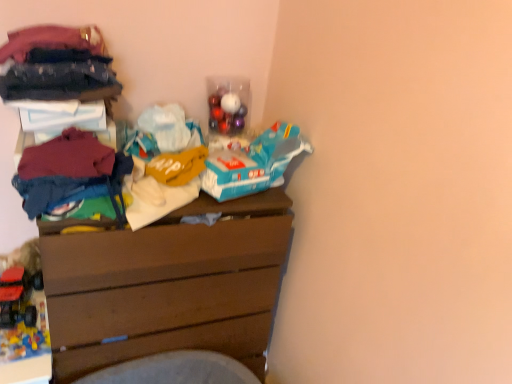
The width and height of the screenshot is (512, 384). What do you see at coordinates (70, 172) in the screenshot?
I see `maroon cotton sweater at left, marked as the third clothing in a top-to-bottom arrangement` at bounding box center [70, 172].

Identify the location of dark blue fabric at upper left, positioned as the first clothing in top-to-bottom order. This screenshot has width=512, height=384. (52, 41).

From the picture: How much space does dark blue fabric at upper left, positioned as the third clothing in bottom-to-top order, occupy horizontally?

The width of dark blue fabric at upper left, positioned as the third clothing in bottom-to-top order, is 11.61 inches.

How much space does rubberized plastic toy truck at lower left, positioned as the 1th toy in bottom-to-top order, occupy vertically?

The height of rubberized plastic toy truck at lower left, positioned as the 1th toy in bottom-to-top order, is 1.82 centimeters.

Find the location of `dark blue fabric at upper left, which is the 2th clothing from top to bottom`. dark blue fabric at upper left, which is the 2th clothing from top to bottom is located at coordinates (60, 82).

Find the location of a particular element. This screenshot has width=512, height=384. maroon cotton sweater at left, the first clothing when ordered from bottom to top is located at coordinates (70, 172).

Is brown wooden chest of drawers at center a part of maroon cotton sweater at left, marked as the third clothing in a top-to-bottom arrangement?

No, brown wooden chest of drawers at center is not inside maroon cotton sweater at left, marked as the third clothing in a top-to-bottom arrangement.

Is maroon cotton sweater at left, marked as the third clothing in a top-to-bottom arrangement, facing towards brown wooden chest of drawers at center?

No.

From the image's perspective, who appears lower, maroon cotton sweater at left, the first clothing when ordered from bottom to top, or brown wooden chest of drawers at center?

From the image's view, brown wooden chest of drawers at center is below.

Consider the image. Is rubberized plastic toy truck at lower left, which ranks as the second toy in top-to-bottom order, smaller than maroon cotton sweater at left, marked as the third clothing in a top-to-bottom arrangement?

Correct, rubberized plastic toy truck at lower left, which ranks as the second toy in top-to-bottom order, occupies less space than maroon cotton sweater at left, marked as the third clothing in a top-to-bottom arrangement.

The width and height of the screenshot is (512, 384). Identify the location of toy that is the 1st one when counting leftward from the maroon cotton sweater at left, the first clothing when ordered from bottom to top. (24, 342).

Is rubberized plastic toy truck at lower left, positioned as the 1th toy in bottom-to-top order, aimed at maroon cotton sweater at left, marked as the third clothing in a top-to-bottom arrangement?

No, rubberized plastic toy truck at lower left, positioned as the 1th toy in bottom-to-top order, is not oriented towards maroon cotton sweater at left, marked as the third clothing in a top-to-bottom arrangement.

Is maroon cotton sweater at left, the first clothing when ordered from bottom to top, surrounded by rubberized plastic toy truck at lower left, which ranks as the second toy in top-to-bottom order?

Definitely not — maroon cotton sweater at left, the first clothing when ordered from bottom to top, is not inside rubberized plastic toy truck at lower left, which ranks as the second toy in top-to-bottom order.

Is brown wooden chest of drawers at center inside the boundaries of dark blue fabric at upper left, positioned as the third clothing in bottom-to-top order, or outside?

brown wooden chest of drawers at center is spatially situated outside dark blue fabric at upper left, positioned as the third clothing in bottom-to-top order.

In the scene shown: From a real-world perspective, is brown wooden chest of drawers at center below dark blue fabric at upper left, positioned as the first clothing in top-to-bottom order?

Yes.

Which is in front, brown wooden chest of drawers at center or dark blue fabric at upper left, positioned as the third clothing in bottom-to-top order?

dark blue fabric at upper left, positioned as the third clothing in bottom-to-top order, is closer to the camera.

Can you tell me how much brown wooden chest of drawers at center and dark blue fabric at upper left, positioned as the first clothing in top-to-bottom order, differ in facing direction?

They differ by 0.903 degrees in their facing directions.

Would you say rubberized plastic toy truck at lower left, which ranks as the second toy in top-to-bottom order, is outside brown wooden chest of drawers at center?

rubberized plastic toy truck at lower left, which ranks as the second toy in top-to-bottom order, lies outside brown wooden chest of drawers at center's area.

Is there a large distance between rubberized plastic toy truck at lower left, positioned as the 1th toy in bottom-to-top order, and brown wooden chest of drawers at center?

Actually, rubberized plastic toy truck at lower left, positioned as the 1th toy in bottom-to-top order, and brown wooden chest of drawers at center are a little close together.

Which object is positioned more to the left, rubberized plastic toy truck at lower left, which ranks as the second toy in top-to-bottom order, or brown wooden chest of drawers at center?

rubberized plastic toy truck at lower left, which ranks as the second toy in top-to-bottom order.

I want to click on toy that is the 1st one when counting backward from the brown wooden chest of drawers at center, so click(24, 342).

Is point (99, 32) less distant than point (28, 315)?

Yes, it is.

Looking at their sizes, would you say dark blue fabric at upper left, positioned as the third clothing in bottom-to-top order, is wider or thinner than rubberized plastic toy truck at lower left, placed as the 2th toy when sorted from bottom to top?

dark blue fabric at upper left, positioned as the third clothing in bottom-to-top order, is wider than rubberized plastic toy truck at lower left, placed as the 2th toy when sorted from bottom to top.

Between dark blue fabric at upper left, positioned as the third clothing in bottom-to-top order, and rubberized plastic toy truck at lower left, acting as the first toy starting from the top, which one has more height?

rubberized plastic toy truck at lower left, acting as the first toy starting from the top, is taller.

Choose the correct answer: Is dark blue fabric at upper left, positioned as the third clothing in bottom-to-top order, inside rubberized plastic toy truck at lower left, placed as the 2th toy when sorted from bottom to top, or outside it?

dark blue fabric at upper left, positioned as the third clothing in bottom-to-top order, is located beyond the bounds of rubberized plastic toy truck at lower left, placed as the 2th toy when sorted from bottom to top.

Is the position of dark blue fabric at upper left, positioned as the third clothing in bottom-to-top order, more distant than that of maroon cotton sweater at left, the first clothing when ordered from bottom to top?

Yes, dark blue fabric at upper left, positioned as the third clothing in bottom-to-top order, is further from the camera.

Is maroon cotton sweater at left, the first clothing when ordered from bottom to top, a part of dark blue fabric at upper left, positioned as the first clothing in top-to-bottom order?

No, maroon cotton sweater at left, the first clothing when ordered from bottom to top, is not inside dark blue fabric at upper left, positioned as the first clothing in top-to-bottom order.

Who is smaller, dark blue fabric at upper left, positioned as the first clothing in top-to-bottom order, or maroon cotton sweater at left, marked as the third clothing in a top-to-bottom arrangement?

maroon cotton sweater at left, marked as the third clothing in a top-to-bottom arrangement, is smaller.

Considering the points (29, 57) and (84, 178), which point is in front, point (29, 57) or point (84, 178)?

The point (84, 178) is closer to the camera.

Between dark blue fabric at upper left, the 2th clothing from the bottom, and brown wooden chest of drawers at center, which one has more height?

brown wooden chest of drawers at center.

Is dark blue fabric at upper left, which is the 2th clothing from top to bottom, aimed at brown wooden chest of drawers at center?

No, dark blue fabric at upper left, which is the 2th clothing from top to bottom, does not turn towards brown wooden chest of drawers at center.

Identify the location of the 2nd clothing in front when counting from the brown wooden chest of drawers at center. The height and width of the screenshot is (384, 512). (60, 82).

Is dark blue fabric at upper left, which is the 2th clothing from top to bottom, next to brown wooden chest of drawers at center and touching it?

They are not placed beside each other.

Starting from the brown wooden chest of drawers at center, which clothing is the 3rd one in front? Please provide its 2D coordinates.

[(70, 172)]

From a real-world perspective, which toy is the 2nd one underneath the maroon cotton sweater at left, the first clothing when ordered from bottom to top? Please provide its 2D coordinates.

[(24, 342)]

Looking at the image, which one is located closer to dark blue fabric at upper left, which is the 2th clothing from top to bottom, dark blue fabric at upper left, positioned as the third clothing in bottom-to-top order, or rubberized plastic toy truck at lower left, which ranks as the second toy in top-to-bottom order?

dark blue fabric at upper left, positioned as the third clothing in bottom-to-top order, is closer to dark blue fabric at upper left, which is the 2th clothing from top to bottom.

When comparing their distances from rubberized plastic toy truck at lower left, placed as the 2th toy when sorted from bottom to top, does rubberized plastic toy truck at lower left, positioned as the 1th toy in bottom-to-top order, or brown wooden chest of drawers at center seem closer?

The object closer to rubberized plastic toy truck at lower left, placed as the 2th toy when sorted from bottom to top, is rubberized plastic toy truck at lower left, positioned as the 1th toy in bottom-to-top order.

Looking at the image, which one is located further to rubberized plastic toy truck at lower left, placed as the 2th toy when sorted from bottom to top, brown wooden chest of drawers at center or maroon cotton sweater at left, marked as the third clothing in a top-to-bottom arrangement?

The object further to rubberized plastic toy truck at lower left, placed as the 2th toy when sorted from bottom to top, is maroon cotton sweater at left, marked as the third clothing in a top-to-bottom arrangement.

From the image, which object appears to be farther from rubberized plastic toy truck at lower left, placed as the 2th toy when sorted from bottom to top, brown wooden chest of drawers at center or rubberized plastic toy truck at lower left, which ranks as the second toy in top-to-bottom order?

brown wooden chest of drawers at center.

From the image, which object appears to be farther from maroon cotton sweater at left, the first clothing when ordered from bottom to top, rubberized plastic toy truck at lower left, placed as the 2th toy when sorted from bottom to top, or rubberized plastic toy truck at lower left, which ranks as the second toy in top-to-bottom order?

rubberized plastic toy truck at lower left, placed as the 2th toy when sorted from bottom to top, lies further to maroon cotton sweater at left, the first clothing when ordered from bottom to top, than the other object.

When comparing their distances from brown wooden chest of drawers at center, does dark blue fabric at upper left, the 2th clothing from the bottom, or maroon cotton sweater at left, the first clothing when ordered from bottom to top, seem closer?

maroon cotton sweater at left, the first clothing when ordered from bottom to top, lies closer to brown wooden chest of drawers at center than the other object.

Considering their positions, is maroon cotton sweater at left, marked as the third clothing in a top-to-bottom arrangement, positioned closer to dark blue fabric at upper left, which is the 2th clothing from top to bottom, than dark blue fabric at upper left, positioned as the third clothing in bottom-to-top order?

The object closer to dark blue fabric at upper left, which is the 2th clothing from top to bottom, is dark blue fabric at upper left, positioned as the third clothing in bottom-to-top order.

In the scene shown: Considering their positions, is dark blue fabric at upper left, positioned as the first clothing in top-to-bottom order, positioned further to rubberized plastic toy truck at lower left, which ranks as the second toy in top-to-bottom order, than dark blue fabric at upper left, the 2th clothing from the bottom?

dark blue fabric at upper left, positioned as the first clothing in top-to-bottom order, is positioned further to the anchor rubberized plastic toy truck at lower left, which ranks as the second toy in top-to-bottom order.

The height and width of the screenshot is (384, 512). Identify the location of toy between dark blue fabric at upper left, the 2th clothing from the bottom, and rubberized plastic toy truck at lower left, positioned as the 1th toy in bottom-to-top order, from top to bottom. (17, 297).

The height and width of the screenshot is (384, 512). In order to click on toy between maroon cotton sweater at left, marked as the third clothing in a top-to-bottom arrangement, and rubberized plastic toy truck at lower left, positioned as the 1th toy in bottom-to-top order, vertically in this screenshot , I will do `click(17, 297)`.

I want to click on toy situated between rubberized plastic toy truck at lower left, placed as the 2th toy when sorted from bottom to top, and brown wooden chest of drawers at center from left to right, so click(24, 342).

Locate an element on the screen. The image size is (512, 384). toy between dark blue fabric at upper left, which is the 2th clothing from top to bottom, and brown wooden chest of drawers at center in the up-down direction is located at coordinates tap(17, 297).